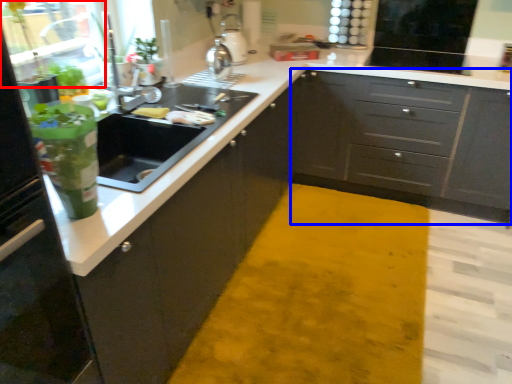
Question: Among these objects, which one is nearest to the camera, glass door (highlighted by a red box) or cabinetry (highlighted by a blue box)?

Choices:
 (A) glass door
 (B) cabinetry

Answer: (A)